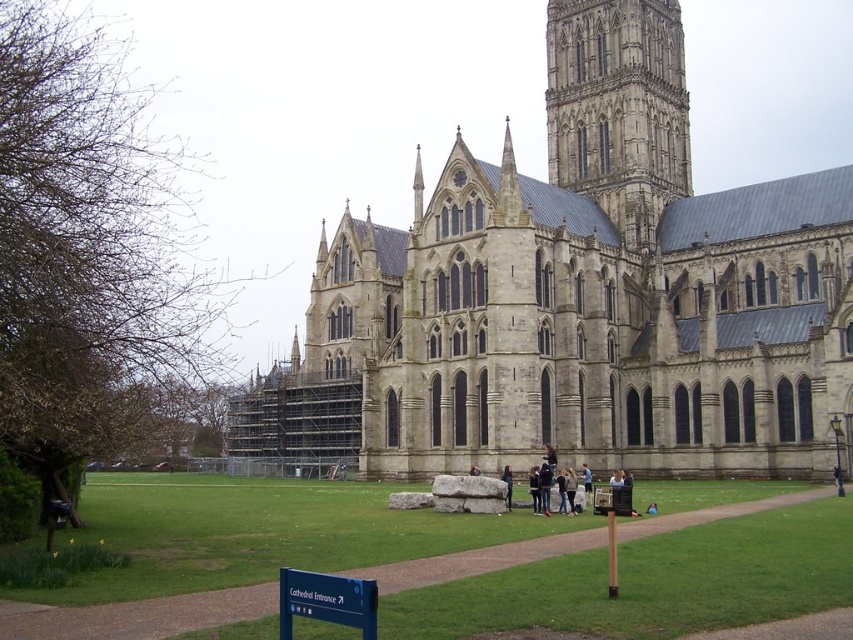
You are standing at the point marked by the coordinates point (618, 108) in front of the grand Gothic cathedral. Which architectural feature of the cathedral does this point indicate?

The point (618, 108) marks the stone gothic tower at center.